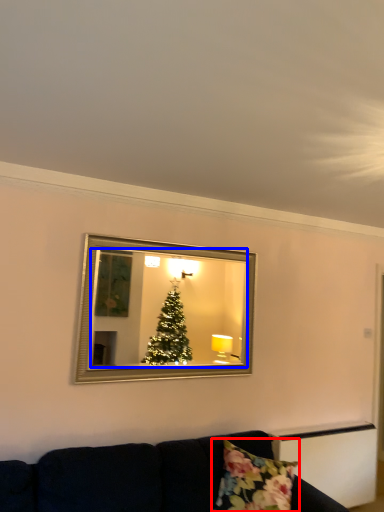
Question: Which of the following is the farthest to the observer, pillow (highlighted by a red box) or mirror (highlighted by a blue box)?

Choices:
 (A) pillow
 (B) mirror

Answer: (B)